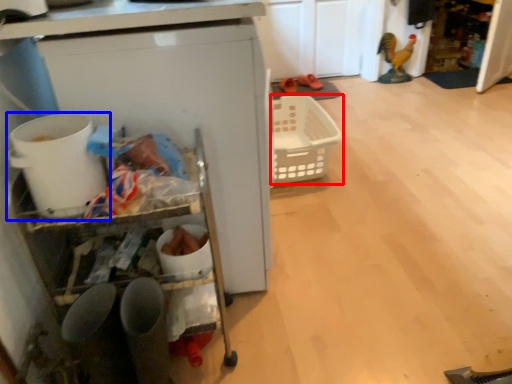
Question: Which object is further to the camera taking this photo, basket (highlighted by a red box) or appliance (highlighted by a blue box)?

Choices:
 (A) basket
 (B) appliance

Answer: (A)